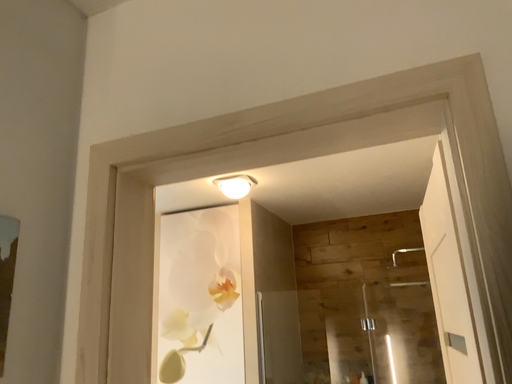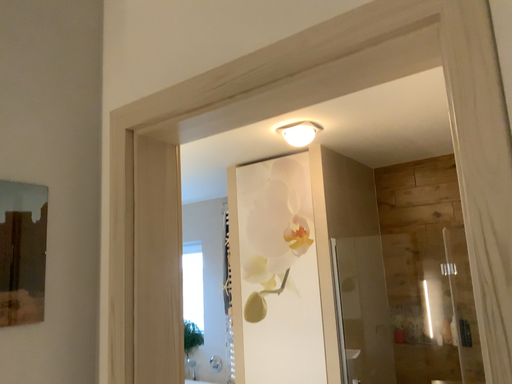
Question: Which way did the camera rotate in the video?

Choices:
 (A) rotated upward
 (B) rotated downward

Answer: (B)